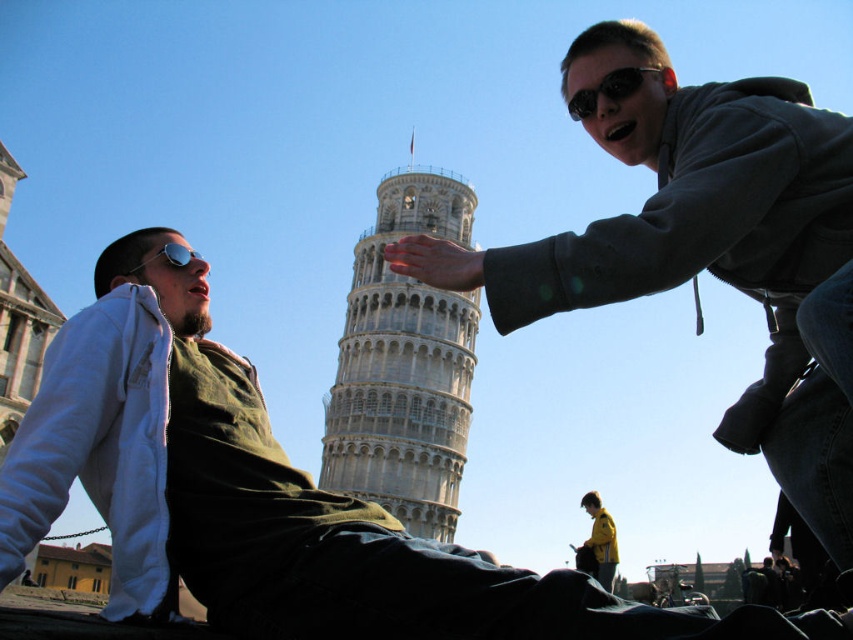
Can you confirm if white stone tower at center is positioned above silver reflective sunglasses at upper left?

No.

Identify the location of white stone tower at center. This screenshot has height=640, width=853. (404, 364).

Which is behind, point (138, 554) or point (184, 257)?

The point (184, 257) is behind.

Does point (293, 573) come farther from viewer compared to point (167, 243)?

That is False.

Image resolution: width=853 pixels, height=640 pixels. In order to click on matte black jacket at center in this screenshot , I will do `click(265, 499)`.

Can you confirm if matte black jacket at center is wider than dark gray hoodie at upper right?

Correct, the width of matte black jacket at center exceeds that of dark gray hoodie at upper right.

Can you confirm if matte black jacket at center is smaller than dark gray hoodie at upper right?

Yes.

Between point (16, 576) and point (805, 406), which one is positioned in front?

Point (16, 576) is more forward.

You are a GUI agent. You are given a task and a screenshot of the screen. Output one action in this format:
    pyautogui.click(x=<x>, y=<y>)
    Task: Click on the matte black jacket at center
    The image size is (853, 640).
    Given the screenshot: What is the action you would take?
    pyautogui.click(x=265, y=499)